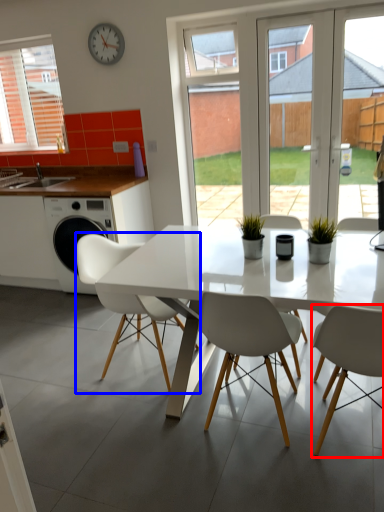
Question: Which object is closer to the camera taking this photo, chair (highlighted by a red box) or chair (highlighted by a blue box)?

Choices:
 (A) chair
 (B) chair

Answer: (A)